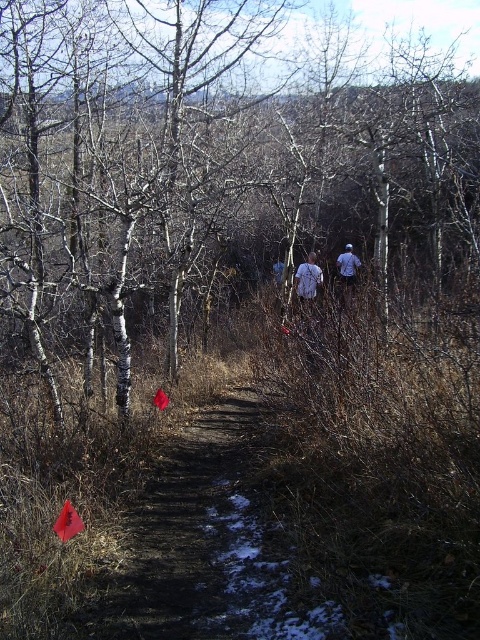
You are a hiker trying to follow the red flags along the path. You notice a white bark tree at center and a blue denim jacket at center. Which object is closer to the path you should follow?

The white bark tree at center is to the left of the blue denim jacket at center, so the blue denim jacket at center is closer to the path you should follow.

You are a photographer standing on the narrow dirt path in the forest. You want to capture a photo of both the white matte shirt at center and the blue denim jacket at center without cropping either. Which direction should you move to ensure both are fully visible in your frame?

You should move to the right side of the path to ensure both the white matte shirt at center and the blue denim jacket at center are fully visible in your frame since the white matte shirt at center might be wider than the blue denim jacket at center, requiring more space in the frame.